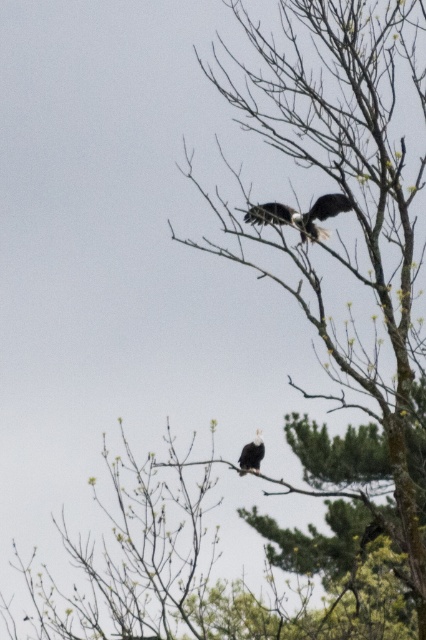
Question: Does dark brown feathers at upper center have a lesser width compared to white feathered eagle at upper right?

Choices:
 (A) no
 (B) yes

Answer: (A)

Question: From the image, what is the correct spatial relationship of dark brown feathers at upper center in relation to white feathered eagle at upper right?

Choices:
 (A) below
 (B) above

Answer: (B)

Question: Considering the relative positions of dark brown feathers at upper center and white feathered eagle at upper right in the image provided, where is dark brown feathers at upper center located with respect to white feathered eagle at upper right?

Choices:
 (A) right
 (B) left

Answer: (A)

Question: Among these objects, which one is nearest to the camera?

Choices:
 (A) white feathered eagle at upper right
 (B) dark brown feathers at upper center

Answer: (B)